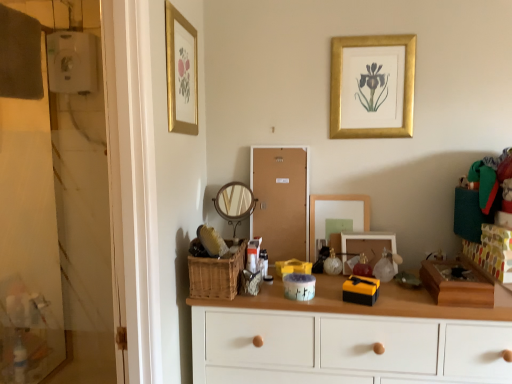
Question: From a real-world perspective, is wooden round mirror at center, acting as the second mirror starting from the right, physically below translucent plastic container at center?

Choices:
 (A) yes
 (B) no

Answer: (B)

Question: Is wooden round mirror at center, acting as the second mirror starting from the right, smaller than translucent plastic container at center?

Choices:
 (A) no
 (B) yes

Answer: (A)

Question: Does wooden round mirror at center, placed as the 1th mirror when sorted from left to right, have a lesser width compared to translucent plastic container at center?

Choices:
 (A) yes
 (B) no

Answer: (A)

Question: Is wooden round mirror at center, acting as the second mirror starting from the right, positioned with its back to translucent plastic container at center?

Choices:
 (A) no
 (B) yes

Answer: (A)

Question: Is wooden round mirror at center, acting as the second mirror starting from the right, bigger than translucent plastic container at center?

Choices:
 (A) yes
 (B) no

Answer: (A)

Question: From the image's perspective, would you say wooden round mirror at center, placed as the 1th mirror when sorted from left to right, is shown under translucent plastic container at center?

Choices:
 (A) yes
 (B) no

Answer: (B)

Question: Is matte glass mirror at center, placed as the second mirror when sorted from left to right, bigger than gold framed print at upper left, the 2th picture frame positioned from the bottom?

Choices:
 (A) yes
 (B) no

Answer: (A)

Question: Does matte glass mirror at center, placed as the second mirror when sorted from left to right, have a greater height compared to gold framed print at upper left, the 2th picture frame viewed from the top?

Choices:
 (A) yes
 (B) no

Answer: (B)

Question: Can you confirm if matte glass mirror at center, which ranks as the 1th mirror in right-to-left order, is thinner than gold framed print at upper left, which appears as the first picture frame when viewed from the left?

Choices:
 (A) yes
 (B) no

Answer: (B)

Question: From a real-world perspective, is matte glass mirror at center, placed as the second mirror when sorted from left to right, on top of gold framed print at upper left, which appears as the first picture frame when viewed from the left?

Choices:
 (A) no
 (B) yes

Answer: (A)

Question: From the image's perspective, is matte glass mirror at center, placed as the second mirror when sorted from left to right, over gold framed print at upper left, the 2th picture frame positioned from the bottom?

Choices:
 (A) no
 (B) yes

Answer: (A)

Question: Can you confirm if matte glass mirror at center, placed as the second mirror when sorted from left to right, is positioned to the right of gold framed print at upper left, which appears as the first picture frame when viewed from the left?

Choices:
 (A) no
 (B) yes

Answer: (B)

Question: Is wooden picture frame at center, the 2th picture frame from the left, at the left side of wooden box at right?

Choices:
 (A) no
 (B) yes

Answer: (B)